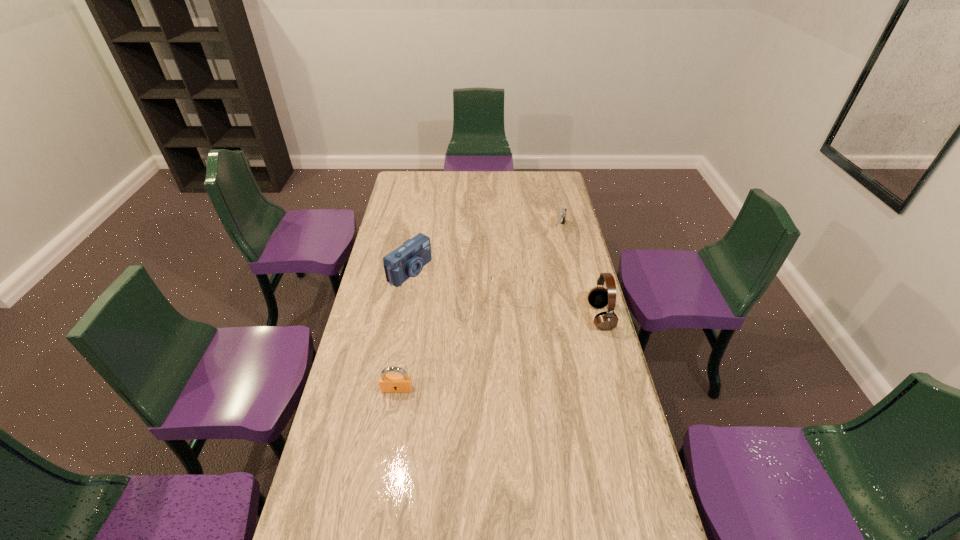
Locate an element on the screen. the nearest object is located at coordinates (389, 383).

Find the location of `the tallest object`. the tallest object is located at coordinates (598, 297).

Where is `spectacles`? spectacles is located at coordinates (522, 301).

Find the location of a particular element. the third object from right to left is located at coordinates (522, 301).

Find the location of a particular element. The height and width of the screenshot is (540, 960). camera is located at coordinates (406, 261).

The image size is (960, 540). Find the location of `the farthest object`. the farthest object is located at coordinates [562, 214].

Find the location of `free space located to unlock the nearest object from the front`. free space located to unlock the nearest object from the front is located at coordinates (393, 413).

The width and height of the screenshot is (960, 540). In order to click on vacant position located 0.060m on the ear pads of the headset in this screenshot , I will do `click(573, 317)`.

The image size is (960, 540). I want to click on vacant region located 0.310m on the ear pads of the headset, so click(x=506, y=317).

Where is `free space located on the ear pads of the headset`? free space located on the ear pads of the headset is located at coordinates (538, 317).